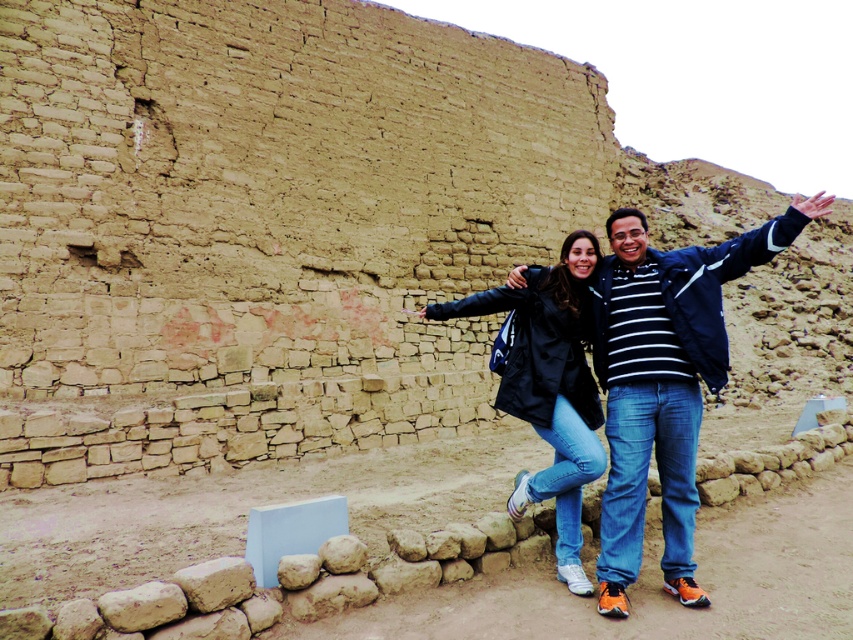
Question: Does matte black jacket at center have a smaller size compared to black matte jacket at center?

Choices:
 (A) yes
 (B) no

Answer: (B)

Question: Which point is closer to the camera taking this photo?

Choices:
 (A) (596, 326)
 (B) (576, 584)

Answer: (B)

Question: Does matte black jacket at center appear over black matte jacket at center?

Choices:
 (A) no
 (B) yes

Answer: (B)

Question: From the image, what is the correct spatial relationship of matte black jacket at center in relation to black matte jacket at center?

Choices:
 (A) left
 (B) right

Answer: (B)